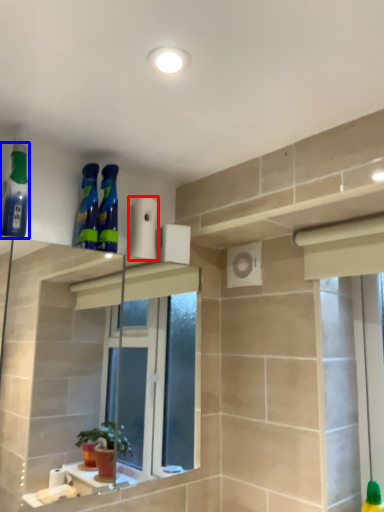
Question: Which of the following is the closest to the observer, toilet paper (highlighted by a red box) or cleaning product (highlighted by a blue box)?

Choices:
 (A) toilet paper
 (B) cleaning product

Answer: (B)